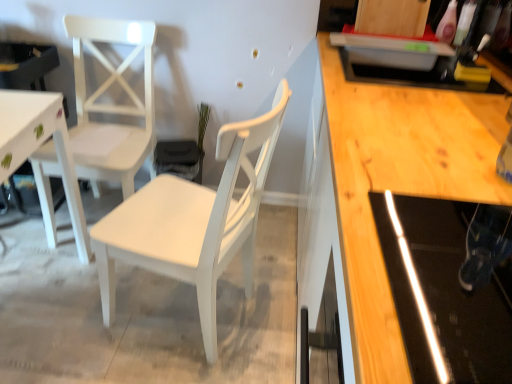
Question: Which direction should I rotate to look at white painted wood chair at center, marked as the second chair in a left-to-right arrangement, — up or down?

Choices:
 (A) down
 (B) up

Answer: (A)

Question: Is white painted wood chair at center, positioned as the 1th chair in right-to-left order, completely or partially inside white matte chair at left, positioned as the 2th chair in right-to-left order?

Choices:
 (A) no
 (B) yes

Answer: (A)

Question: From the image's perspective, is white matte chair at left, positioned as the 2th chair in right-to-left order, below white painted wood chair at center, positioned as the 1th chair in right-to-left order?

Choices:
 (A) yes
 (B) no

Answer: (B)

Question: Is white matte chair at left, positioned as the 2th chair in right-to-left order, positioned far away from white painted wood chair at center, positioned as the 1th chair in right-to-left order?

Choices:
 (A) no
 (B) yes

Answer: (A)

Question: Is white matte chair at left, positioned as the 2th chair in right-to-left order, located outside white painted wood chair at center, marked as the second chair in a left-to-right arrangement?

Choices:
 (A) no
 (B) yes

Answer: (B)

Question: Is white matte chair at left, the 1th chair in the left-to-right sequence, wider than white painted wood chair at center, marked as the second chair in a left-to-right arrangement?

Choices:
 (A) no
 (B) yes

Answer: (A)

Question: Is white matte chair at left, the 1th chair in the left-to-right sequence, facing towards white painted wood chair at center, positioned as the 1th chair in right-to-left order?

Choices:
 (A) no
 (B) yes

Answer: (A)

Question: From the image's perspective, does white painted wood chair at center, marked as the second chair in a left-to-right arrangement, appear higher than white matte chair at left, the 1th chair in the left-to-right sequence?

Choices:
 (A) no
 (B) yes

Answer: (A)

Question: Is white painted wood chair at center, marked as the second chair in a left-to-right arrangement, to the right of white matte chair at left, the 1th chair in the left-to-right sequence, from the viewer's perspective?

Choices:
 (A) no
 (B) yes

Answer: (B)

Question: Are white painted wood chair at center, positioned as the 1th chair in right-to-left order, and white matte chair at left, positioned as the 2th chair in right-to-left order, located far from each other?

Choices:
 (A) yes
 (B) no

Answer: (B)

Question: Is white painted wood chair at center, marked as the second chair in a left-to-right arrangement, in front of white matte chair at left, positioned as the 2th chair in right-to-left order?

Choices:
 (A) yes
 (B) no

Answer: (A)

Question: Does white painted wood chair at center, marked as the second chair in a left-to-right arrangement, come behind white matte chair at left, positioned as the 2th chair in right-to-left order?

Choices:
 (A) no
 (B) yes

Answer: (A)

Question: From the image's perspective, does white painted wood chair at center, marked as the second chair in a left-to-right arrangement, appear lower than white matte chair at left, the 1th chair in the left-to-right sequence?

Choices:
 (A) no
 (B) yes

Answer: (B)

Question: Looking at the image, does white painted wood chair at center, marked as the second chair in a left-to-right arrangement, seem bigger or smaller compared to white matte chair at left, positioned as the 2th chair in right-to-left order?

Choices:
 (A) small
 (B) big

Answer: (B)